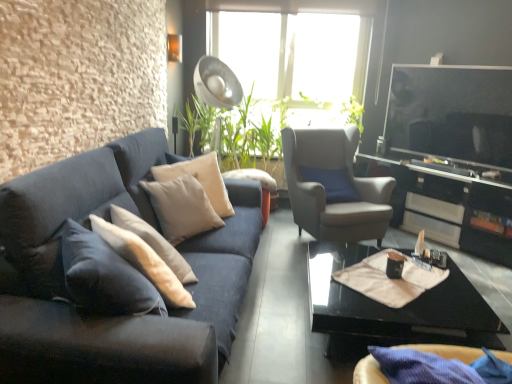
The width and height of the screenshot is (512, 384). What do you see at coordinates (181, 208) in the screenshot?
I see `beige fabric pillow at center, arranged as the 2th pillow when viewed from the back` at bounding box center [181, 208].

Identify the location of black glossy entertainment center at right. (454, 206).

This screenshot has height=384, width=512. What do you see at coordinates (390, 279) in the screenshot? I see `beige fabric at center` at bounding box center [390, 279].

This screenshot has width=512, height=384. In order to click on black glossy coffee table at lower right in this screenshot , I will do `click(395, 309)`.

Who is taller, suede-like gray armchair at center-right or beige fabric pillow at center, arranged as the 2th pillow when viewed from the back?

suede-like gray armchair at center-right.

Which object is closer to the camera taking this photo, suede-like gray armchair at center-right or beige fabric pillow at center, arranged as the 2th pillow when viewed from the back?

beige fabric pillow at center, arranged as the 2th pillow when viewed from the back, is more forward.

Which of these two, suede-like gray armchair at center-right or beige fabric pillow at center, the first pillow in the front-to-back sequence, is smaller?

With smaller size is beige fabric pillow at center, the first pillow in the front-to-back sequence.

Does point (81, 362) come farther from viewer compared to point (198, 189)?

No, (81, 362) is closer to viewer.

From the image's perspective, is velvet dark blue couch at left located above or below beige fabric pillow at center, the first pillow in the front-to-back sequence?

velvet dark blue couch at left is below beige fabric pillow at center, the first pillow in the front-to-back sequence.

Is beige fabric pillow at center, arranged as the 2th pillow when viewed from the back, completely or partially inside velvet dark blue couch at left?

No, beige fabric pillow at center, arranged as the 2th pillow when viewed from the back, is not a part of velvet dark blue couch at left.

From the image's perspective, does black glossy coffee table at lower right appear lower than creamy white fabric pillow at center, marked as the first pillow in a back-to-front arrangement?

Yes, from the image's perspective, black glossy coffee table at lower right is beneath creamy white fabric pillow at center, marked as the first pillow in a back-to-front arrangement.

Which is behind, point (421, 308) or point (222, 187)?

The point (222, 187) is farther.

Is black glossy coffee table at lower right to the left of creamy white fabric pillow at center, marked as the first pillow in a back-to-front arrangement, from the viewer's perspective?

In fact, black glossy coffee table at lower right is to the right of creamy white fabric pillow at center, marked as the first pillow in a back-to-front arrangement.

Is beige fabric pillow at center, arranged as the 2th pillow when viewed from the back, not close to beige fabric at center?

Yes, beige fabric pillow at center, arranged as the 2th pillow when viewed from the back, and beige fabric at center are quite far apart.

In the scene shown: Can you confirm if beige fabric pillow at center, the first pillow in the front-to-back sequence, is bigger than beige fabric at center?

Correct, beige fabric pillow at center, the first pillow in the front-to-back sequence, is larger in size than beige fabric at center.

Is point (170, 204) closer or farther from the camera than point (422, 281)?

Point (170, 204) appears to be farther away from the viewer than point (422, 281).

Who is shorter, beige fabric pillow at center, the first pillow in the front-to-back sequence, or beige fabric at center?

Standing shorter between the two is beige fabric at center.

Between black glossy coffee table at lower right and black glossy entertainment center at right, which one appears on the left side from the viewer's perspective?

black glossy coffee table at lower right is more to the left.

Locate an element on the screen. Image resolution: width=512 pixels, height=384 pixels. coffee table in front of the black glossy entertainment center at right is located at coordinates (395, 309).

Measure the distance between black glossy coffee table at lower right and black glossy entertainment center at right.

A distance of 1.39 meters exists between black glossy coffee table at lower right and black glossy entertainment center at right.

From the image's perspective, between creamy white fabric pillow at center, the second pillow when ordered from front to back, and beige fabric at center, who is located below?

beige fabric at center is shown below in the image.

Locate an element on the screen. the 2nd pillow directly above the beige fabric at center (from a real-world perspective) is located at coordinates (200, 179).

Is creamy white fabric pillow at center, marked as the first pillow in a back-to-front arrangement, spatially inside beige fabric at center, or outside of it?

creamy white fabric pillow at center, marked as the first pillow in a back-to-front arrangement, exists outside the volume of beige fabric at center.

From a real-world perspective, which is physically above, velvet dark blue couch at left or suede-like gray armchair at center-right?

velvet dark blue couch at left.

Consider the image. Between velvet dark blue couch at left and suede-like gray armchair at center-right, which one has larger width?

Wider between the two is suede-like gray armchair at center-right.

Is velvet dark blue couch at left bigger than suede-like gray armchair at center-right?

No, velvet dark blue couch at left is not bigger than suede-like gray armchair at center-right.

Image resolution: width=512 pixels, height=384 pixels. Find the location of `chair located behind the beige fabric pillow at center, the first pillow in the front-to-back sequence`. chair located behind the beige fabric pillow at center, the first pillow in the front-to-back sequence is located at coordinates (334, 187).

The width and height of the screenshot is (512, 384). What are the coordinates of `pillow that is the 1st one when counting rightward from the velvet dark blue couch at left` in the screenshot? It's located at (181, 208).

Which object lies nearer to the anchor point suede-like gray armchair at center-right, beige fabric at center or beige fabric pillow at center, the first pillow in the front-to-back sequence?

Based on the image, beige fabric at center appears to be nearer to suede-like gray armchair at center-right.

Looking at the image, which one is located further to black glossy entertainment center at right, beige fabric pillow at center, arranged as the 2th pillow when viewed from the back, or suede-like gray armchair at center-right?

beige fabric pillow at center, arranged as the 2th pillow when viewed from the back, is positioned further to the anchor black glossy entertainment center at right.

From the picture: When comparing their distances from black glossy coffee table at lower right, does creamy white fabric pillow at center, marked as the first pillow in a back-to-front arrangement, or black glossy entertainment center at right seem closer?

Among the two, creamy white fabric pillow at center, marked as the first pillow in a back-to-front arrangement, is located nearer to black glossy coffee table at lower right.

Considering their positions, is beige fabric pillow at center, the first pillow in the front-to-back sequence, positioned further to suede-like gray armchair at center-right than beige fabric at center?

beige fabric pillow at center, the first pillow in the front-to-back sequence, lies further to suede-like gray armchair at center-right than the other object.

Considering their positions, is black glossy entertainment center at right positioned further to black glossy coffee table at lower right than beige fabric pillow at center, arranged as the 2th pillow when viewed from the back?

black glossy entertainment center at right.

Which object lies nearer to the anchor point velvet dark blue couch at left, black glossy entertainment center at right or black glossy coffee table at lower right?

Based on the image, black glossy coffee table at lower right appears to be nearer to velvet dark blue couch at left.

Based on their spatial positions, is beige fabric pillow at center, arranged as the 2th pillow when viewed from the back, or black glossy entertainment center at right further from creamy white fabric pillow at center, marked as the first pillow in a back-to-front arrangement?

black glossy entertainment center at right lies further to creamy white fabric pillow at center, marked as the first pillow in a back-to-front arrangement, than the other object.

Estimate the real-world distances between objects in this image. Which object is closer to suede-like gray armchair at center-right, black glossy entertainment center at right or velvet dark blue couch at left?

Based on the image, black glossy entertainment center at right appears to be nearer to suede-like gray armchair at center-right.

The height and width of the screenshot is (384, 512). What are the coordinates of `pillow located between beige fabric pillow at center, arranged as the 2th pillow when viewed from the back, and beige fabric at center in the left-right direction` in the screenshot? It's located at (200, 179).

I want to click on coffee table located between velvet dark blue couch at left and suede-like gray armchair at center-right in the depth direction, so click(x=395, y=309).

Where is `chair between velvet dark blue couch at left and black glossy entertainment center at right in the horizontal direction`? chair between velvet dark blue couch at left and black glossy entertainment center at right in the horizontal direction is located at coordinates (334, 187).

Where is `chair located between creamy white fabric pillow at center, marked as the first pillow in a back-to-front arrangement, and black glossy coffee table at lower right in the left-right direction`? chair located between creamy white fabric pillow at center, marked as the first pillow in a back-to-front arrangement, and black glossy coffee table at lower right in the left-right direction is located at coordinates (334, 187).